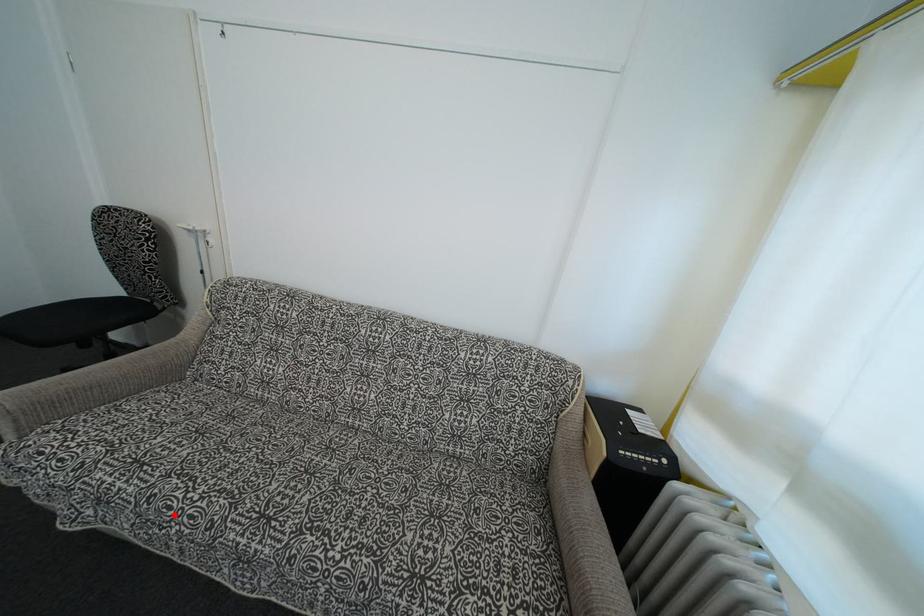
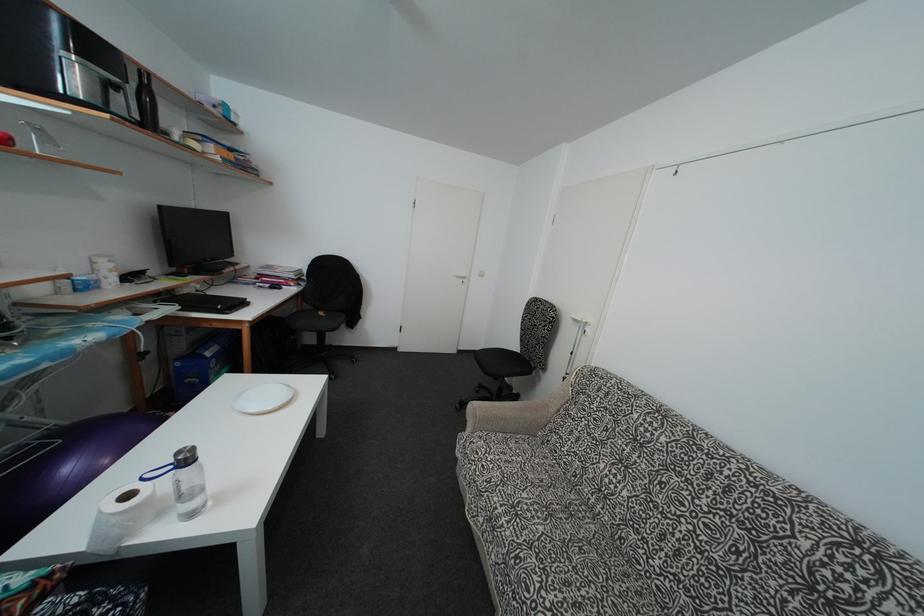
Locate, in the second image, the point that corresponds to the highlighted location in the first image.

(532, 598)